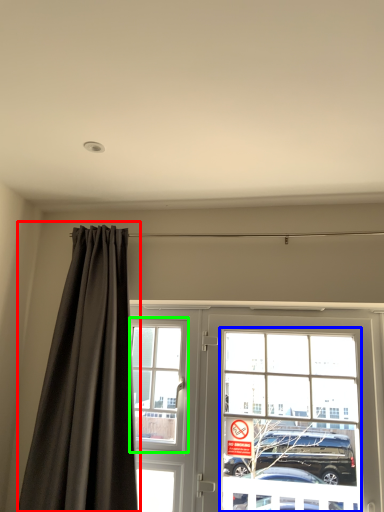
Question: Which object is the closest to the curtain (highlighted by a red box)? Choose among these: bay window (highlighted by a blue box) or window (highlighted by a green box).

Choices:
 (A) bay window
 (B) window

Answer: (B)